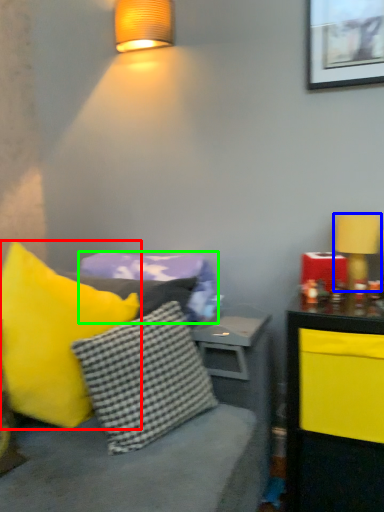
Question: Which object is the farthest from pillow (highlighted by a red box)? Choose among these: table lamp (highlighted by a blue box) or pillow (highlighted by a green box).

Choices:
 (A) table lamp
 (B) pillow

Answer: (A)